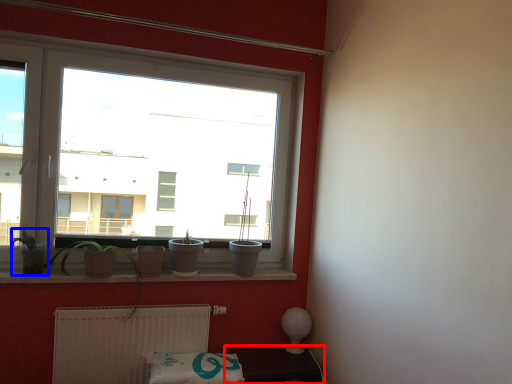
Question: Which object appears farthest to the camera in this image, furniture (highlighted by a red box) or plant (highlighted by a blue box)?

Choices:
 (A) furniture
 (B) plant

Answer: (A)